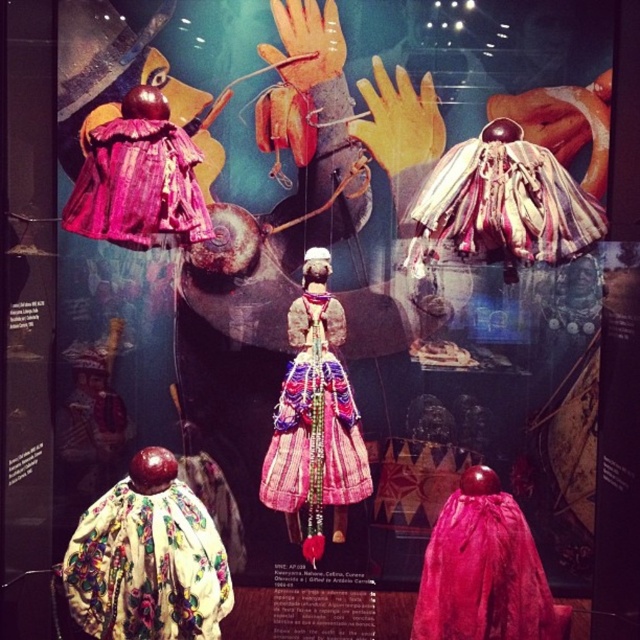
Please look at the point located at coordinate [147,566] in the image. Which object is this point located on?

The point at coordinate [147,566] is located on the floral fabric cape at lower left.

Consider the image. You are a museum visitor holding a 15 inch wide box. You want to place it between the floral fabric cape at lower left and the multicolored fabric dress at center. Is there enough space?

The distance between the floral fabric cape at lower left and the multicolored fabric dress at center is 14.87 inches, which is slightly less than the 15 inch wide box. Therefore, there is not enough space to place the box between them.